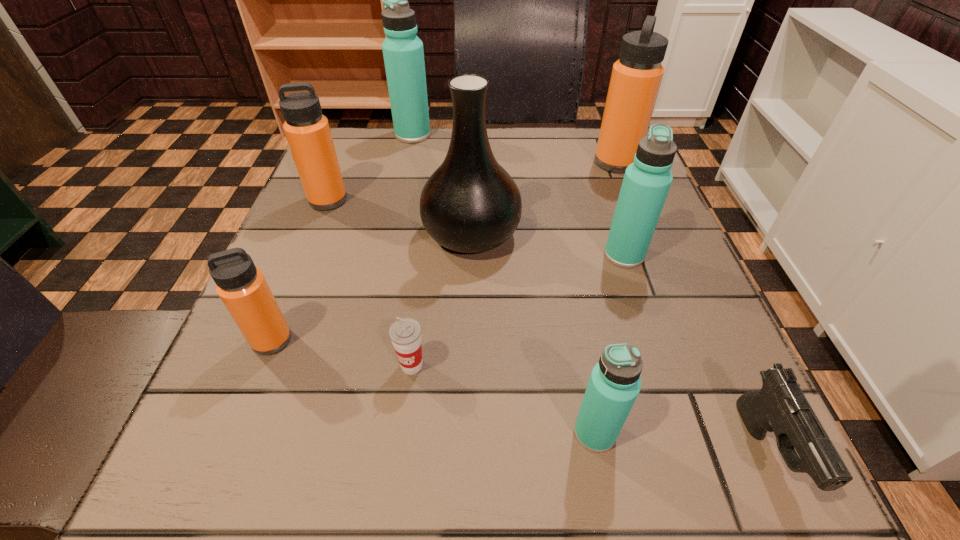
Locate an element on the screen. The width and height of the screenshot is (960, 540). the nearest aqua thermos bottle is located at coordinates (614, 384).

Identify the location of the smallest orange thermos bottle. This screenshot has height=540, width=960. (243, 289).

Find the location of `the fifth farthest thermos bottle`. the fifth farthest thermos bottle is located at coordinates tap(243, 289).

The image size is (960, 540). What are the coordinates of `cup` in the screenshot? It's located at pyautogui.click(x=405, y=333).

The image size is (960, 540). In order to click on black pistol in this screenshot , I will do `click(780, 406)`.

Where is `vacant region located on the front of the seventh object from right to left`? vacant region located on the front of the seventh object from right to left is located at coordinates (402, 184).

Where is `vacant space located 0.250m on the front of the eighth nearest object`? vacant space located 0.250m on the front of the eighth nearest object is located at coordinates (650, 250).

Locate an element on the screen. The image size is (960, 540). vacant region located 0.110m on the right of the vase is located at coordinates (577, 233).

This screenshot has width=960, height=540. I want to click on free space located on the back of the fourth nearest thermos bottle, so click(348, 150).

Identify the location of vacant region located 0.070m on the left of the fourth farthest thermos bottle. (566, 255).